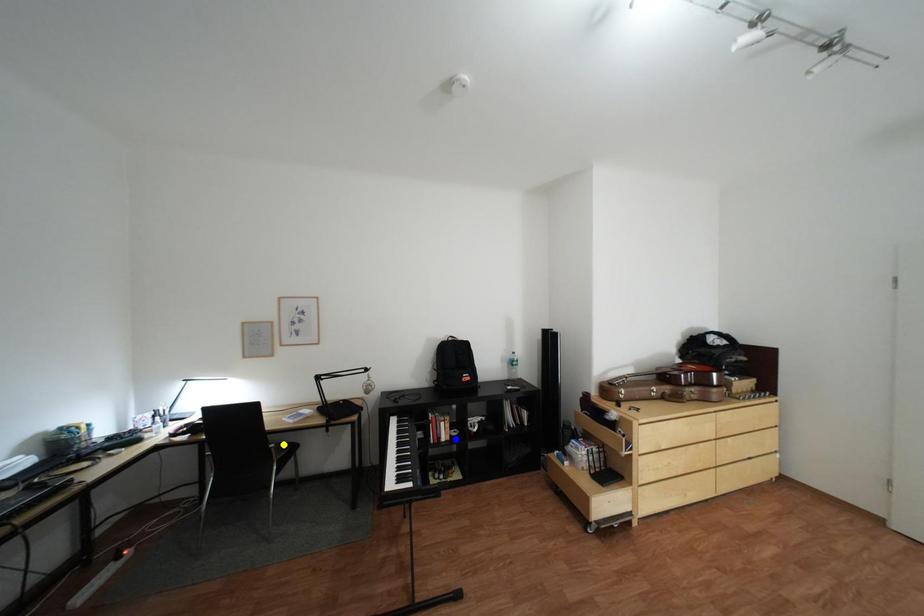
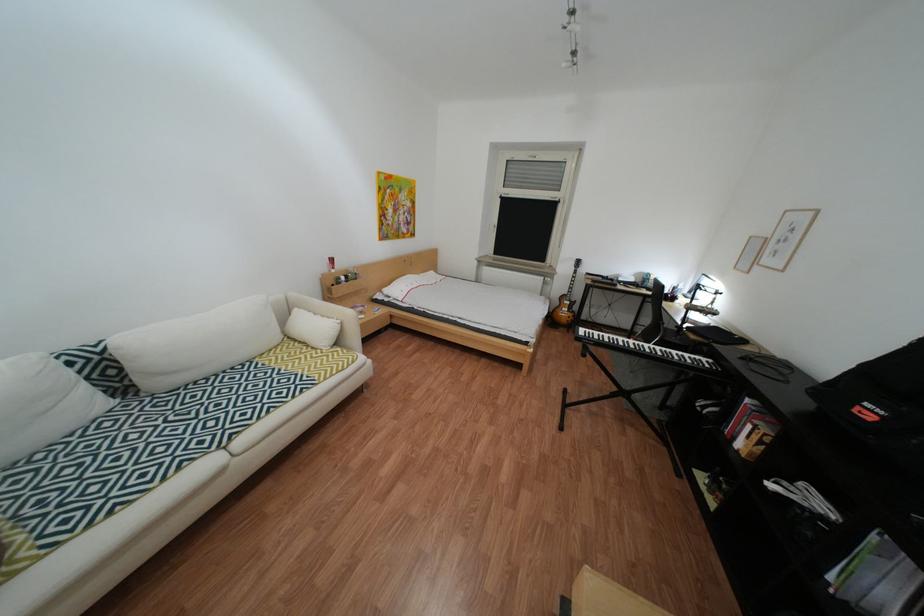
I am providing you with two images of the same scene from different viewpoints. Three points are marked in image1. Which point corresponds to a part or object that is occluded in image2?In image1, three points are marked. Which of them correspond to a part or object that is occluded in image2?Among the three points shown in image1, which one corresponds to a part or object that is no longer visible due to occlusion in image2?

yellow point